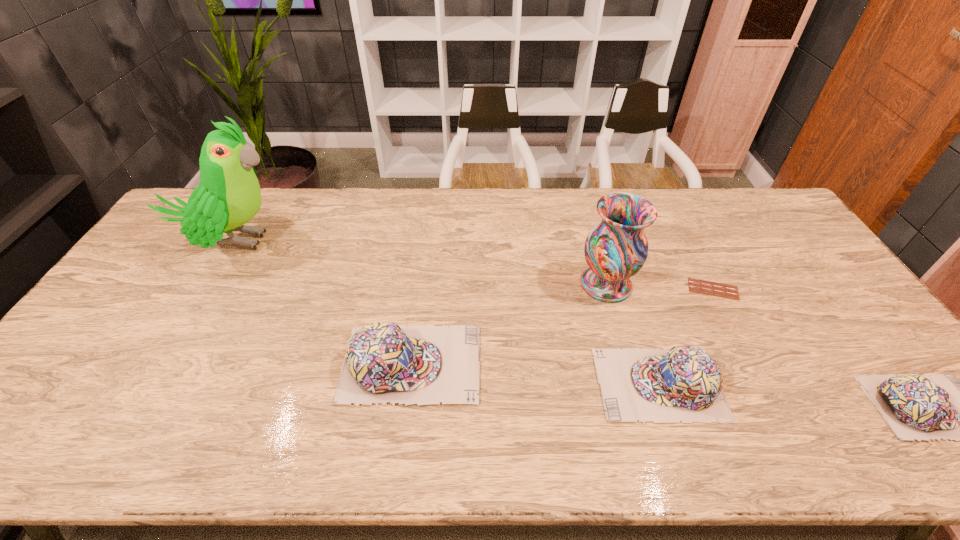
Find the location of `the leftmost cap`. the leftmost cap is located at coordinates (384, 362).

Identify the location of the third shortest object. (685, 384).

Where is `the second tallest cap`? Image resolution: width=960 pixels, height=540 pixels. the second tallest cap is located at coordinates (685, 384).

Locate an element on the screen. The image size is (960, 540). chocolate bar is located at coordinates (711, 288).

Identify the location of the fifth object from left to right. (711, 288).

Locate an element on the screen. parakeet is located at coordinates (228, 196).

Where is `the leftmost object`? The height and width of the screenshot is (540, 960). the leftmost object is located at coordinates (228, 196).

Locate an element on the screen. Image resolution: width=960 pixels, height=540 pixels. vase is located at coordinates (616, 248).

You are a GUI agent. You are given a task and a screenshot of the screen. Output one action in this format:
    pyautogui.click(x=<x>, y=<y>)
    Task: Click on the blank space located on the front, side, and top of the leftmost cap
    Image resolution: width=960 pixels, height=540 pixels.
    Given the screenshot: What is the action you would take?
    pyautogui.click(x=574, y=363)

Where is `free space located on the front, side, and top of the second shortest cap`? Image resolution: width=960 pixels, height=540 pixels. free space located on the front, side, and top of the second shortest cap is located at coordinates point(455,384).